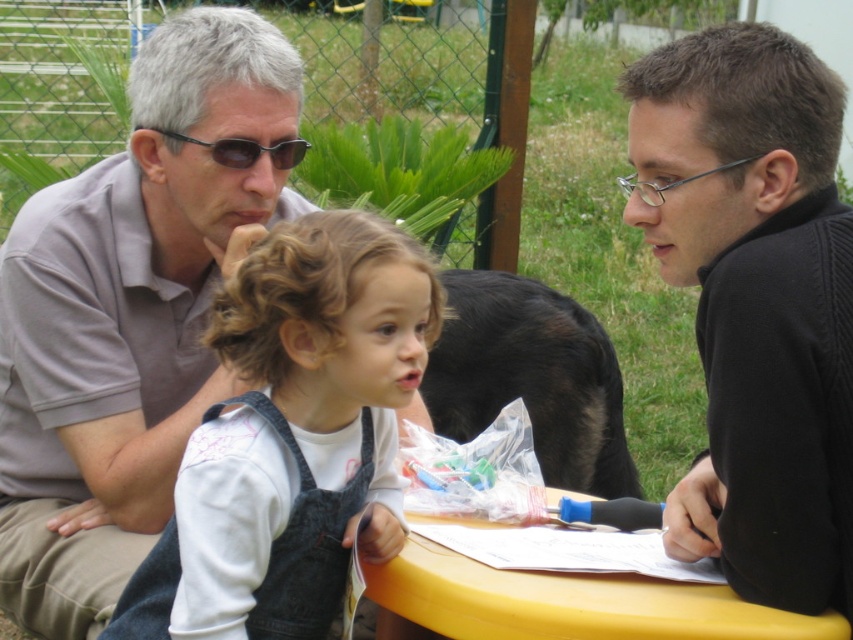
What is the position of the point with coordinates (289,435) in relation to the denim overalls at center?

The point with coordinates (289,435) is located on the denim overalls at center.

What is the exact coordinate of the matte gray shirt at upper left?

The matte gray shirt at upper left is located at coordinate point (129,314).

You are standing in a garden and want to place a small potted plant exactly at point (x=271, y=538). If your arm reaches 5 feet, can you reach that spot?

The distance of point (x=271, y=538) from viewer is 6.06 feet, so no, you cannot reach that spot with an arm reach of 5 feet.